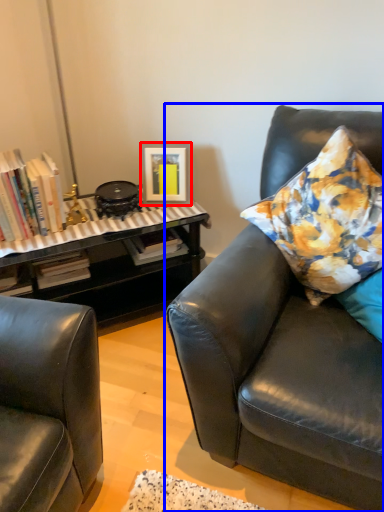
Question: Which object is further to the camera taking this photo, picture frame (highlighted by a red box) or studio couch (highlighted by a blue box)?

Choices:
 (A) picture frame
 (B) studio couch

Answer: (A)